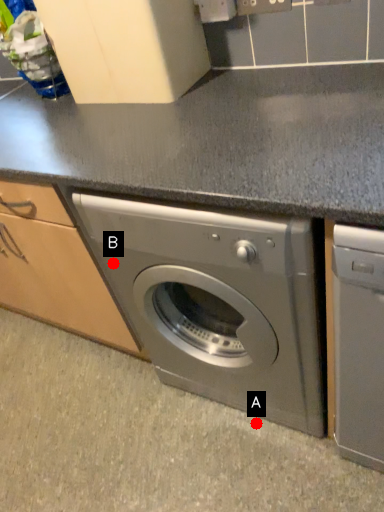
Question: Two points are circled on the image, labeled by A and B beside each circle. Which point is farther to the camera?

Choices:
 (A) A is further
 (B) B is further

Answer: (A)